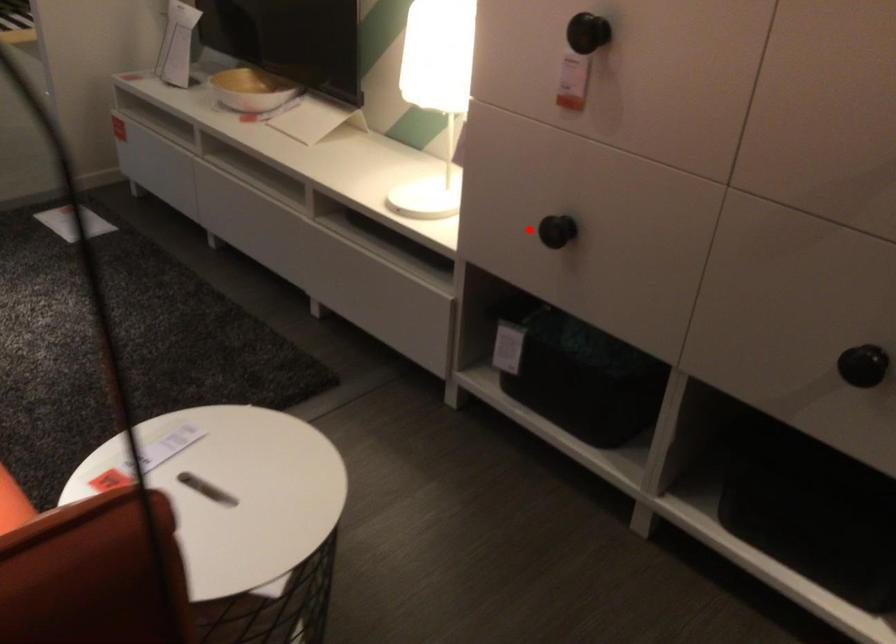
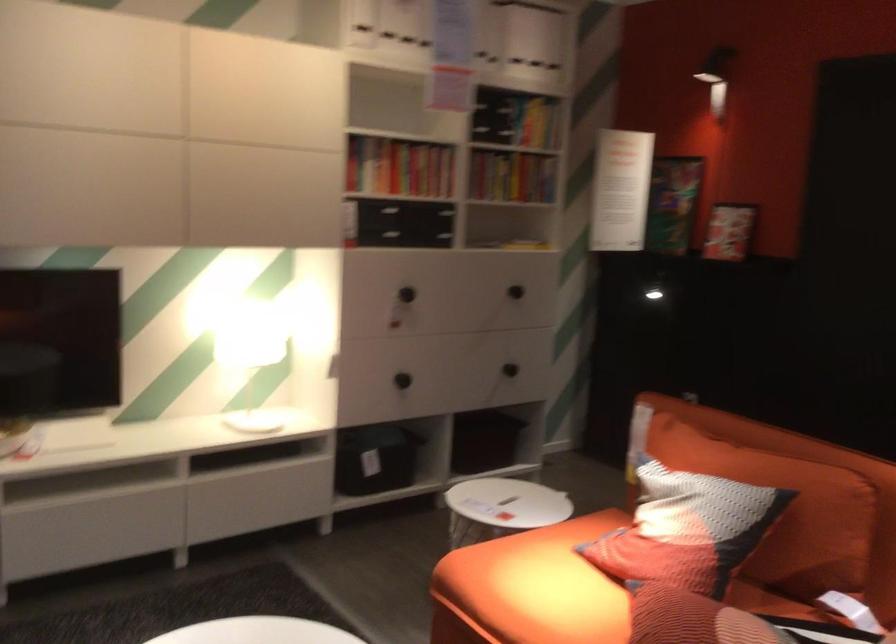
The point at the highlighted location is marked in the first image. Where is the corresponding point in the second image?

(401, 380)